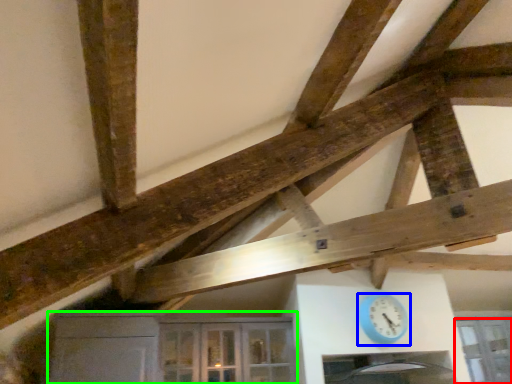
Question: Considering the real-world distances, which object is closest to window (highlighted by a red box)? clock (highlighted by a blue box) or cabinetry (highlighted by a green box).

Choices:
 (A) clock
 (B) cabinetry

Answer: (A)